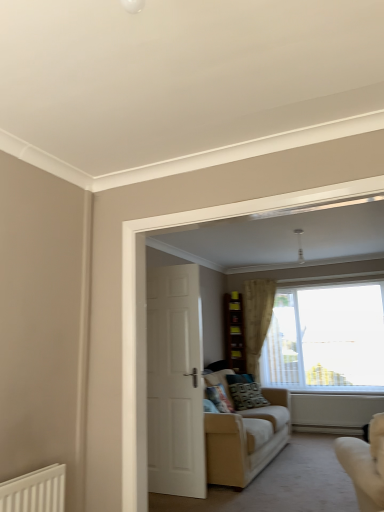
Question: Would you say transparent glass window at center contains patterned fabric pillow at center, the 1th pillow from the right?

Choices:
 (A) no
 (B) yes

Answer: (A)

Question: Is transparent glass window at center aimed at patterned fabric pillow at center, which is the second pillow in left-to-right order?

Choices:
 (A) no
 (B) yes

Answer: (B)

Question: Is transparent glass window at center at the right side of patterned fabric pillow at center, the 1th pillow from the right?

Choices:
 (A) no
 (B) yes

Answer: (B)

Question: Are transparent glass window at center and patterned fabric pillow at center, the 1th pillow from the right, far apart?

Choices:
 (A) yes
 (B) no

Answer: (A)

Question: Considering the relative sizes of transparent glass window at center and patterned fabric pillow at center, the 1th pillow from the right, in the image provided, is transparent glass window at center smaller than patterned fabric pillow at center, the 1th pillow from the right,?

Choices:
 (A) no
 (B) yes

Answer: (A)

Question: From a real-world perspective, is beige fabric couch at lower right, which is the 2th studio couch from back to front, positioned above or below beige fabric couch at center, which is the first studio couch in back-to-front order?

Choices:
 (A) above
 (B) below

Answer: (A)

Question: Would you say beige fabric couch at lower right, marked as the 1th studio couch in a front-to-back arrangement, is inside or outside beige fabric couch at center, which is the first studio couch in back-to-front order?

Choices:
 (A) inside
 (B) outside

Answer: (B)

Question: Is point (370, 452) closer or farther from the camera than point (208, 420)?

Choices:
 (A) farther
 (B) closer

Answer: (B)

Question: From the image's perspective, is beige fabric couch at lower right, marked as the 1th studio couch in a front-to-back arrangement, positioned above or below beige fabric couch at center, which is the first studio couch in back-to-front order?

Choices:
 (A) below
 (B) above

Answer: (B)

Question: Looking at the image, does white glossy door at center seem bigger or smaller compared to beige fabric couch at lower right, marked as the 1th studio couch in a front-to-back arrangement?

Choices:
 (A) big
 (B) small

Answer: (B)

Question: From the image's perspective, is white glossy door at center located above or below beige fabric couch at lower right, marked as the 1th studio couch in a front-to-back arrangement?

Choices:
 (A) above
 (B) below

Answer: (A)

Question: Which is correct: white glossy door at center is inside beige fabric couch at lower right, marked as the 1th studio couch in a front-to-back arrangement, or outside of it?

Choices:
 (A) inside
 (B) outside

Answer: (B)

Question: Visually, is white glossy door at center positioned to the left or to the right of beige fabric couch at lower right, marked as the 1th studio couch in a front-to-back arrangement?

Choices:
 (A) right
 (B) left

Answer: (B)

Question: Considering the positions of patterned fabric pillow at center, the 1th pillow from the right, and white glossy door at center in the image, is patterned fabric pillow at center, the 1th pillow from the right, taller or shorter than white glossy door at center?

Choices:
 (A) short
 (B) tall

Answer: (A)

Question: Is patterned fabric pillow at center, the 1th pillow from the right, spatially inside white glossy door at center, or outside of it?

Choices:
 (A) inside
 (B) outside

Answer: (B)